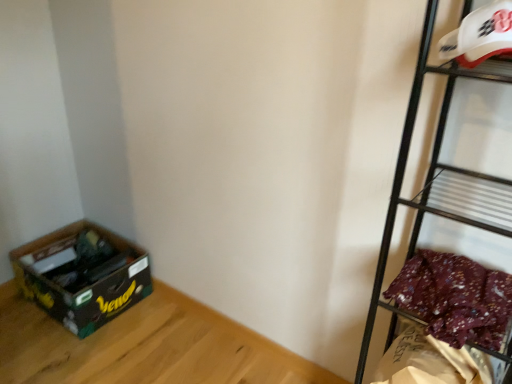
Question: Do you think floral fabric at right is within matte black box at lower left, or outside of it?

Choices:
 (A) outside
 (B) inside

Answer: (A)

Question: Is floral fabric at right bigger or smaller than matte black box at lower left?

Choices:
 (A) big
 (B) small

Answer: (B)

Question: Based on their relative distances, which object is nearer to the floral fabric at right?

Choices:
 (A) white plastic helmet at upper right, marked as the 1th shelf in a top-to-bottom arrangement
 (B) metallic black shelf at right, the 2th shelf positioned from the top
 (C) green cardboard box at lower left
 (D) matte black box at lower left

Answer: (B)

Question: Which object is the farthest from the green cardboard box at lower left?

Choices:
 (A) matte black box at lower left
 (B) floral fabric at right
 (C) metallic black shelf at right, the 2th shelf positioned from the top
 (D) white plastic helmet at upper right, marked as the 1th shelf in a top-to-bottom arrangement

Answer: (D)